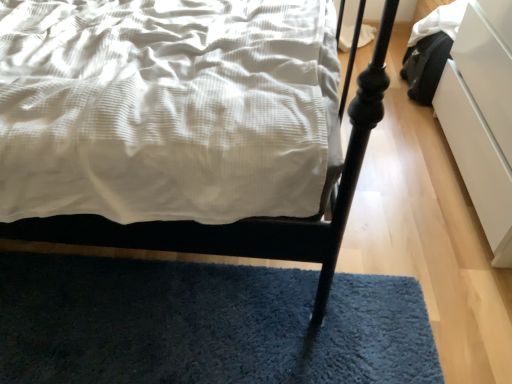
Question: Can you confirm if blue shaggy rug at lower center is taller than matte white bed at center?

Choices:
 (A) no
 (B) yes

Answer: (A)

Question: Does blue shaggy rug at lower center have a greater width compared to matte white bed at center?

Choices:
 (A) yes
 (B) no

Answer: (B)

Question: Is blue shaggy rug at lower center far from matte white bed at center?

Choices:
 (A) yes
 (B) no

Answer: (B)

Question: From a real-world perspective, is blue shaggy rug at lower center positioned over matte white bed at center based on gravity?

Choices:
 (A) yes
 (B) no

Answer: (B)

Question: Does blue shaggy rug at lower center have a larger size compared to matte white bed at center?

Choices:
 (A) no
 (B) yes

Answer: (A)

Question: Would you say matte white bed at center is part of blue shaggy rug at lower center's contents?

Choices:
 (A) yes
 (B) no

Answer: (B)

Question: Is matte white bed at center completely or partially outside of blue shaggy rug at lower center?

Choices:
 (A) no
 (B) yes

Answer: (B)

Question: Is matte white bed at center positioned far away from blue shaggy rug at lower center?

Choices:
 (A) yes
 (B) no

Answer: (B)

Question: Does matte white bed at center appear on the right side of blue shaggy rug at lower center?

Choices:
 (A) yes
 (B) no

Answer: (B)

Question: Considering the relative sizes of matte white bed at center and blue shaggy rug at lower center in the image provided, is matte white bed at center taller than blue shaggy rug at lower center?

Choices:
 (A) no
 (B) yes

Answer: (B)

Question: Considering the relative positions of matte white bed at center and blue shaggy rug at lower center in the image provided, is matte white bed at center behind blue shaggy rug at lower center?

Choices:
 (A) no
 (B) yes

Answer: (A)

Question: From a real-world perspective, does matte white bed at center stand above blue shaggy rug at lower center?

Choices:
 (A) no
 (B) yes

Answer: (B)

Question: Is white glossy drawer at right far from matte white bed at center?

Choices:
 (A) yes
 (B) no

Answer: (B)